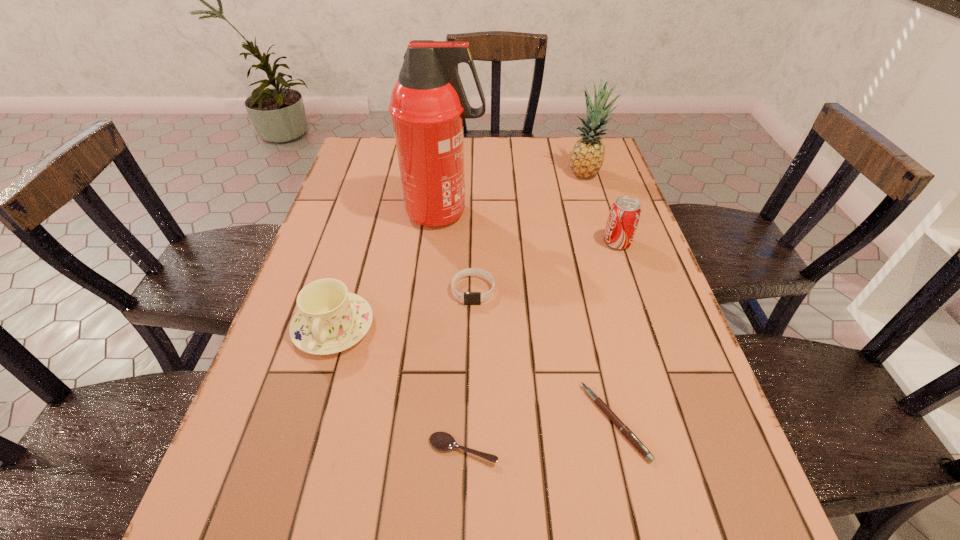
Where is `object present at the far edge`? object present at the far edge is located at coordinates (587, 156).

Locate an element on the screen. object located in the left edge section of the desktop is located at coordinates (330, 319).

Identify the location of pineapple present at the right edge. (x=587, y=156).

Locate an element on the screen. Image resolution: width=960 pixels, height=540 pixels. soda at the right edge is located at coordinates (624, 216).

Where is `pen situated at the right edge`? pen situated at the right edge is located at coordinates (632, 438).

Find the location of a particular element. Image resolution: width=960 pixels, height=540 pixels. object positioned at the far right corner is located at coordinates (587, 156).

Identify the location of free location at the far edge. The height and width of the screenshot is (540, 960). (479, 168).

The height and width of the screenshot is (540, 960). In the image, there is a desktop. Identify the location of vacant area at the near edge. (409, 538).

Find the location of a particular element. The height and width of the screenshot is (540, 960). vacant region at the left edge of the desktop is located at coordinates (318, 279).

Where is `free space at the right edge of the desktop`? Image resolution: width=960 pixels, height=540 pixels. free space at the right edge of the desktop is located at coordinates (597, 286).